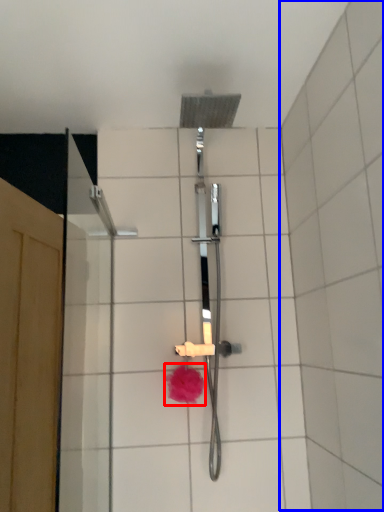
Question: Among these objects, which one is nearest to the camera, flower (highlighted by a red box) or ceramic tile (highlighted by a blue box)?

Choices:
 (A) flower
 (B) ceramic tile

Answer: (B)